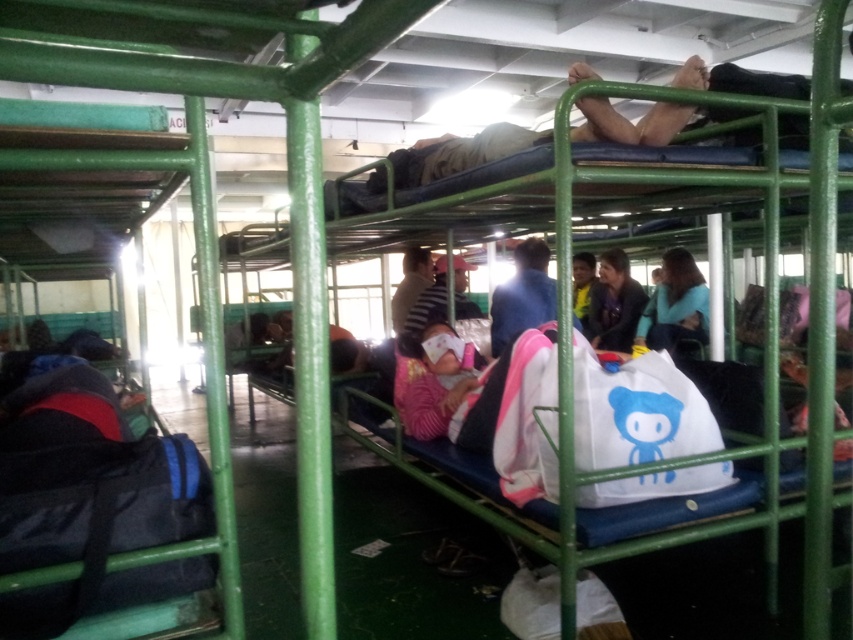
Is light brown fabric at upper center to the right of striped shirt at center from the viewer's perspective?

Yes, light brown fabric at upper center is to the right of striped shirt at center.

The height and width of the screenshot is (640, 853). Describe the element at coordinates (459, 152) in the screenshot. I see `light brown fabric at upper center` at that location.

You are a GUI agent. You are given a task and a screenshot of the screen. Output one action in this format:
    pyautogui.click(x=<x>, y=<y>)
    Task: Click on the light brown fabric at upper center
    The height and width of the screenshot is (640, 853).
    Given the screenshot: What is the action you would take?
    pyautogui.click(x=459, y=152)

Is matte black jacket at center thinner than striped shirt at center?

Incorrect, matte black jacket at center's width is not less than striped shirt at center's.

Does point (618, 298) lie in front of point (409, 284)?

No, (618, 298) is behind (409, 284).

The image size is (853, 640). I want to click on matte black jacket at center, so (x=614, y=304).

Which is behind, point (531, 308) or point (444, 282)?

The point (444, 282) is behind.

Which is below, blue fabric at center or striped fabric shirt at center?

Positioned lower is striped fabric shirt at center.

Find the location of a particular element. blue fabric at center is located at coordinates [x=521, y=296].